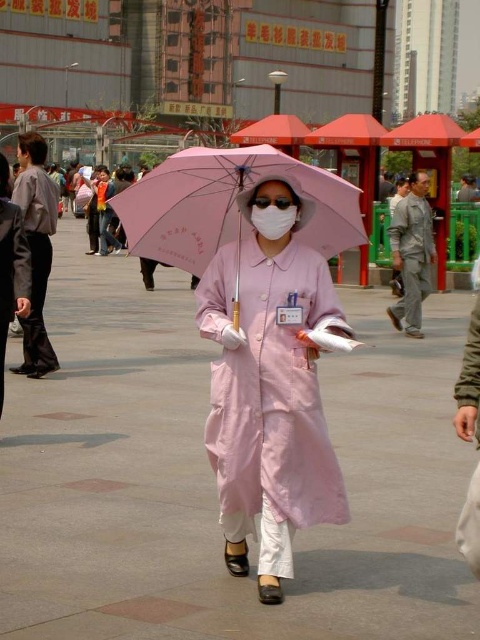
You are a visitor at a cultural event and see the matte gray robe at left and the white matte mask at center. Which object is located more to the left?

The matte gray robe at left is more to the left than the white matte mask at center.

You are a photographer trying to capture a clear shot of the pink fabric umbrella at center. However, the matte pink coat at center is blocking your view. Can you determine if the umbrella is behind or in front of the coat?

The matte pink coat at center is closer to the viewer than the pink fabric umbrella at center, so the umbrella is behind the coat.

Based on the scene description, what object is located at the coordinates point (271, 392)?

The point (271, 392) corresponds to the matte pink coat at center.